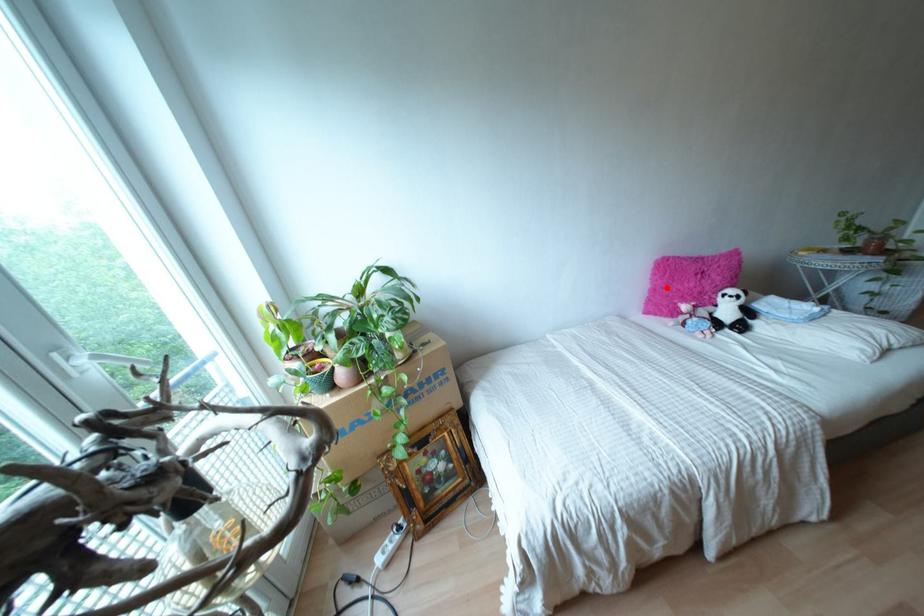
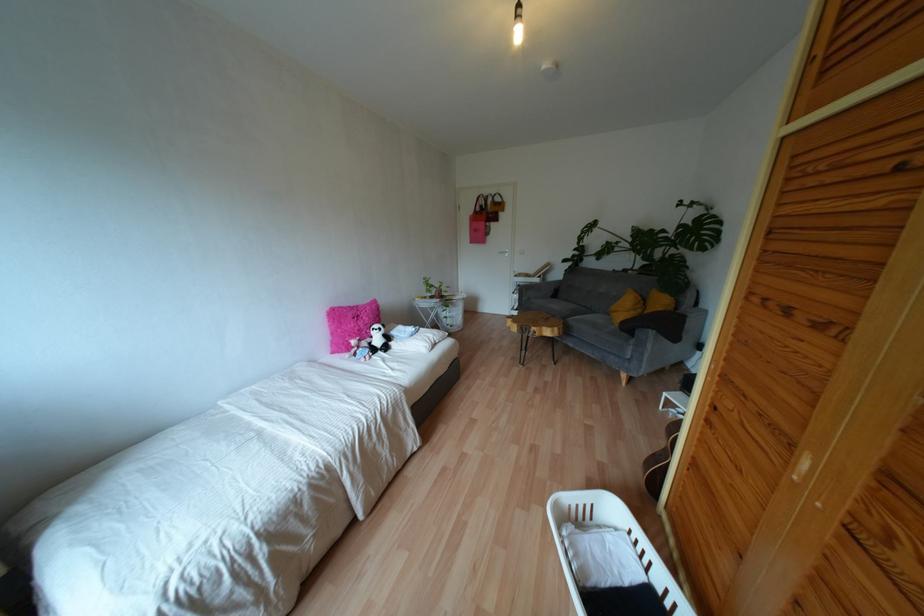
Question: I am providing you with two images of the same scene from different viewpoints. A red point is marked on the first image. Can you still see the location of the red point in image 2?

Choices:
 (A) Yes
 (B) No

Answer: (A)